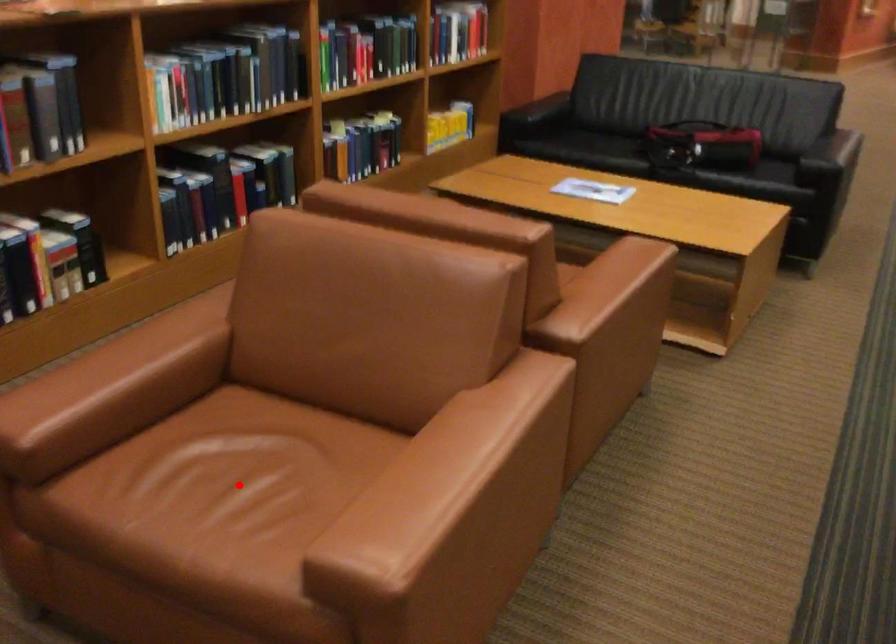
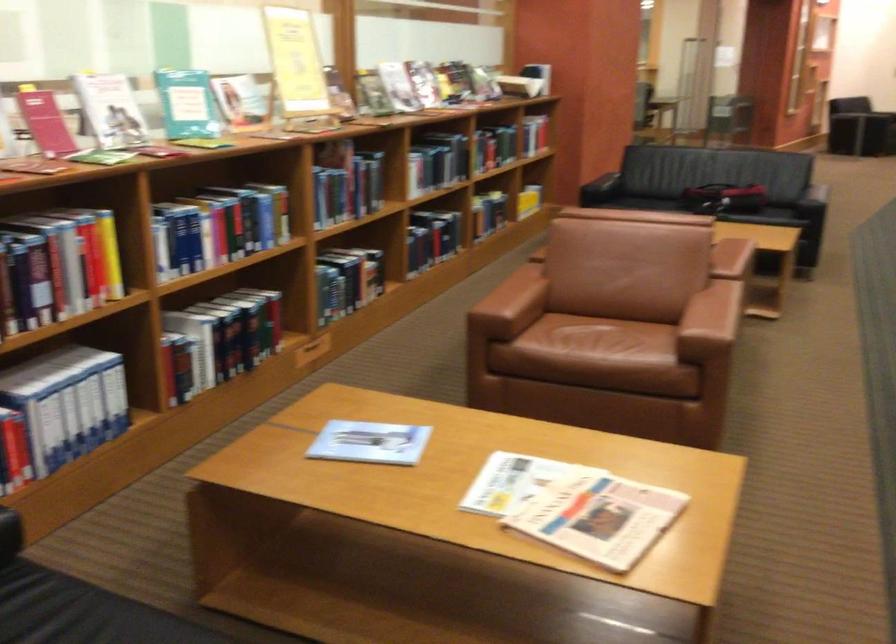
Question: I am providing you with two images of the same scene from different viewpoints. In image1, a red point is highlighted. Considering the same 3D point in image2, which of the following is correct?

Choices:
 (A) It is closer
 (B) It is farther

Answer: (B)